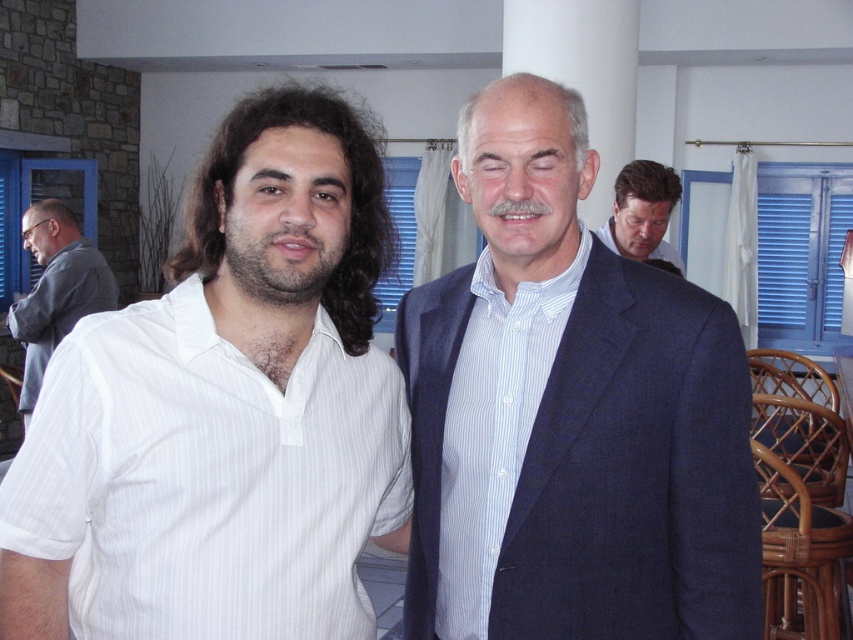
Question: Estimate the real-world distances between objects in this image. Which object is farther from the blue suit at center?

Choices:
 (A) blue suit at upper right
 (B) gray fabric shirt at left
 (C) white striped shirt at left
 (D) white striped shirt at center

Answer: (B)

Question: Can you confirm if white striped shirt at left is positioned above gray fabric shirt at left?

Choices:
 (A) no
 (B) yes

Answer: (A)

Question: Which point is closer to the camera?

Choices:
 (A) blue suit at center
 (B) gray fabric shirt at left
 (C) white striped shirt at left

Answer: (C)

Question: Which object is the farthest from the white striped shirt at left?

Choices:
 (A) blue suit at center
 (B) gray fabric shirt at left
 (C) white striped shirt at center
 (D) blue suit at upper right

Answer: (B)

Question: Can you confirm if white striped shirt at center is thinner than gray fabric shirt at left?

Choices:
 (A) yes
 (B) no

Answer: (A)

Question: Can you confirm if white striped shirt at left is wider than gray fabric shirt at left?

Choices:
 (A) no
 (B) yes

Answer: (A)